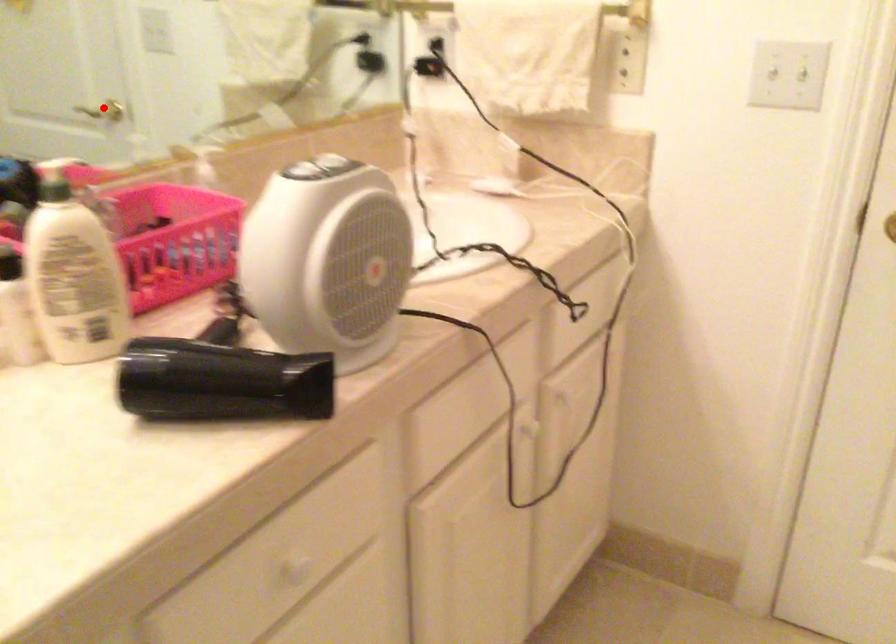
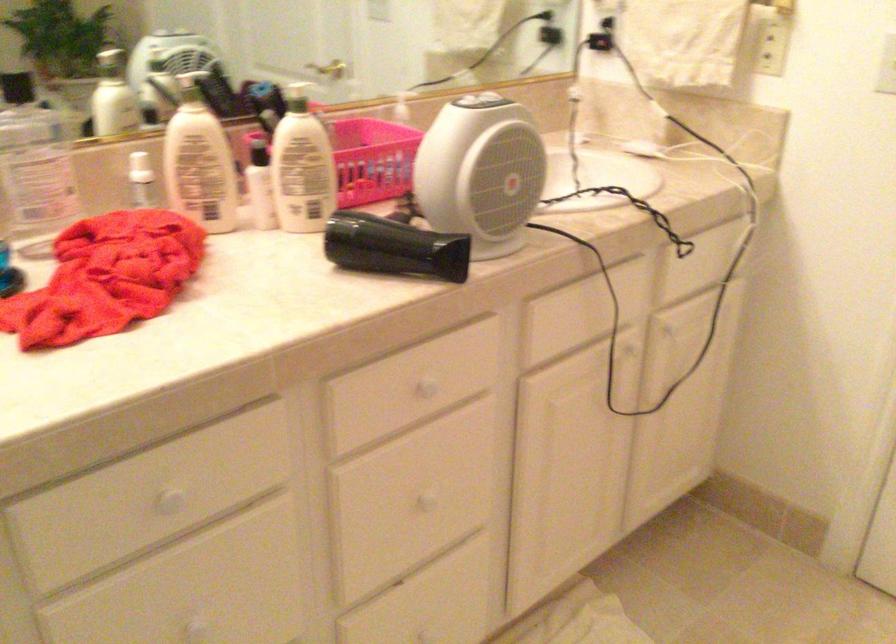
Question: I am providing you with two images of the same scene from different viewpoints. In image1, a red point is highlighted. Considering the same 3D point in image2, which of the following is correct?

Choices:
 (A) It is closer
 (B) It is farther

Answer: (B)